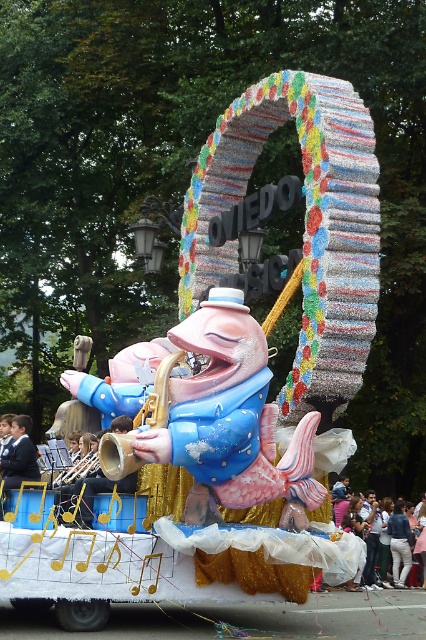
Question: Where is light blue fabric at lower right located in relation to blue jeans at lower right in the image?

Choices:
 (A) below
 (B) above

Answer: (B)

Question: Is gold shiny trumpet at center above blue jeans at lower right?

Choices:
 (A) yes
 (B) no

Answer: (A)

Question: Is blue fabric suit at center thinner than blue jeans at lower right?

Choices:
 (A) no
 (B) yes

Answer: (B)

Question: Which object is the closest to the blue jeans at lower right?

Choices:
 (A) blue fabric suit at center
 (B) light blue fabric at lower right

Answer: (B)

Question: Which of the following is the farthest from the observer?

Choices:
 (A) (402, 525)
 (B) (370, 532)
 (C) (26, 419)

Answer: (A)

Question: Which is farther from the blue fabric suit at center?

Choices:
 (A) light blue fabric at lower right
 (B) gold shiny trumpet at center
 (C) denim jacket at lower right
 (D) blue jeans at lower right

Answer: (D)